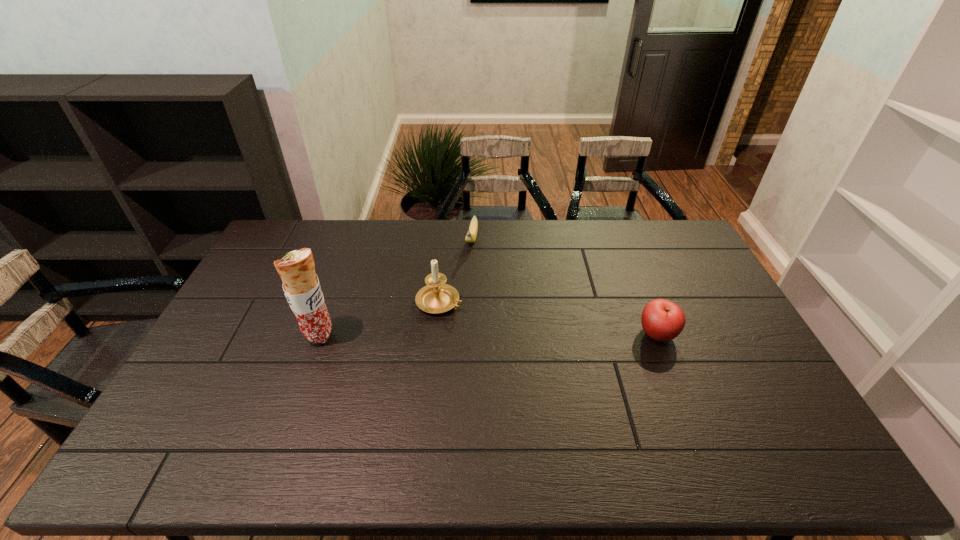
The width and height of the screenshot is (960, 540). I want to click on the leftmost object, so click(301, 286).

Locate an element on the screen. This screenshot has height=540, width=960. the tallest object is located at coordinates [x=301, y=286].

I want to click on apple, so click(662, 320).

This screenshot has width=960, height=540. Identify the location of the third tallest object. (x=662, y=320).

Find the location of a particular element. banana is located at coordinates point(471,235).

Where is `the shortest object`? the shortest object is located at coordinates [471, 235].

Identify the location of the second object from left to right. The image size is (960, 540). (437, 297).

The width and height of the screenshot is (960, 540). What are the coordinates of `candle holder` in the screenshot? It's located at (437, 297).

Locate an element on the screen. This screenshot has width=960, height=540. vacant space situated 0.360m on the back of the leftmost object is located at coordinates (348, 252).

Where is `free location located 0.390m on the left of the second shortest object`? This screenshot has width=960, height=540. free location located 0.390m on the left of the second shortest object is located at coordinates (508, 334).